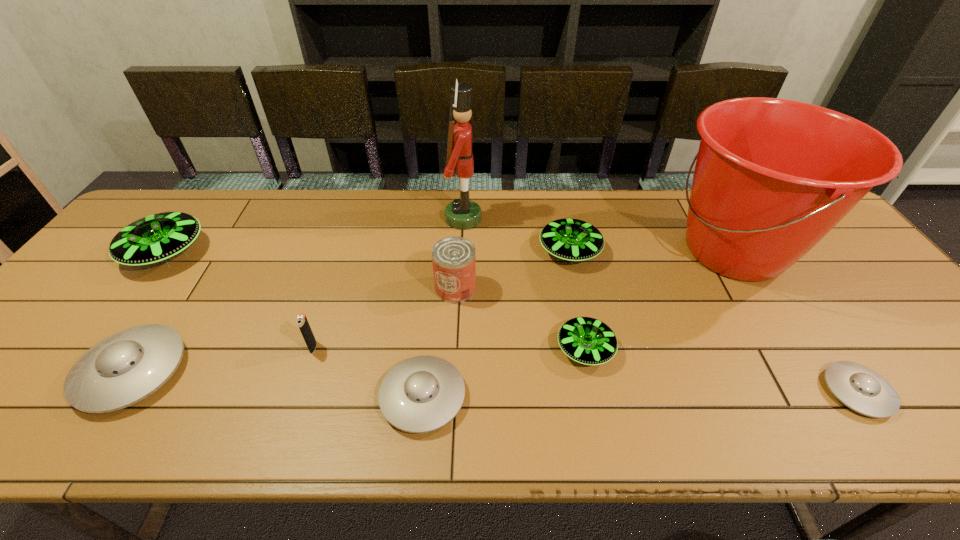
The width and height of the screenshot is (960, 540). Identify the location of bucket that is at the far edge. click(x=773, y=176).

The height and width of the screenshot is (540, 960). What are the coordinates of `object at the left edge` in the screenshot? It's located at (156, 238).

Find the location of a particular element. object located in the right edge section of the desktop is located at coordinates (773, 176).

The image size is (960, 540). Find the location of `object at the far left corner`. object at the far left corner is located at coordinates (156, 238).

I want to click on object present at the far right corner, so click(773, 176).

Locate an element on the screen. This screenshot has width=960, height=540. free space at the far edge is located at coordinates (209, 220).

In the image, there is a desktop. Where is `vacant space at the near edge`? vacant space at the near edge is located at coordinates (468, 408).

This screenshot has height=540, width=960. What are the coordinates of `vacant space at the left edge of the desktop` in the screenshot? It's located at (102, 278).

Where is `free point at the right edge`? Image resolution: width=960 pixels, height=540 pixels. free point at the right edge is located at coordinates (868, 269).

You are a GUI agent. You are given a task and a screenshot of the screen. Output one action in this format:
    pyautogui.click(x=<x>, y=<y>)
    Task: Click on the free space between the fifth shortest saucer and the nutcracker
    Image resolution: width=960 pixels, height=540 pixels.
    Given the screenshot: What is the action you would take?
    point(516,235)